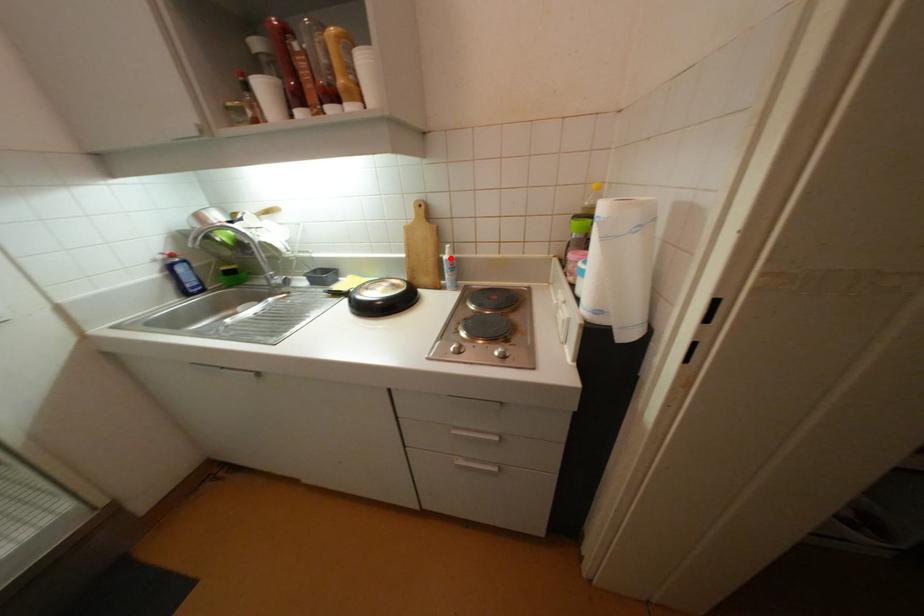
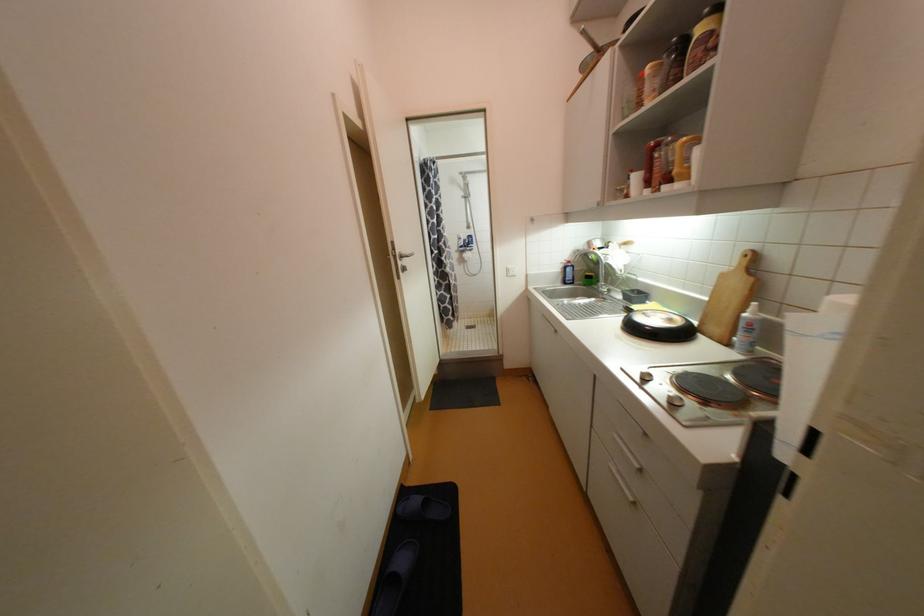
The point at the highlighted location is marked in the first image. Where is the corresponding point in the second image?

(750, 315)